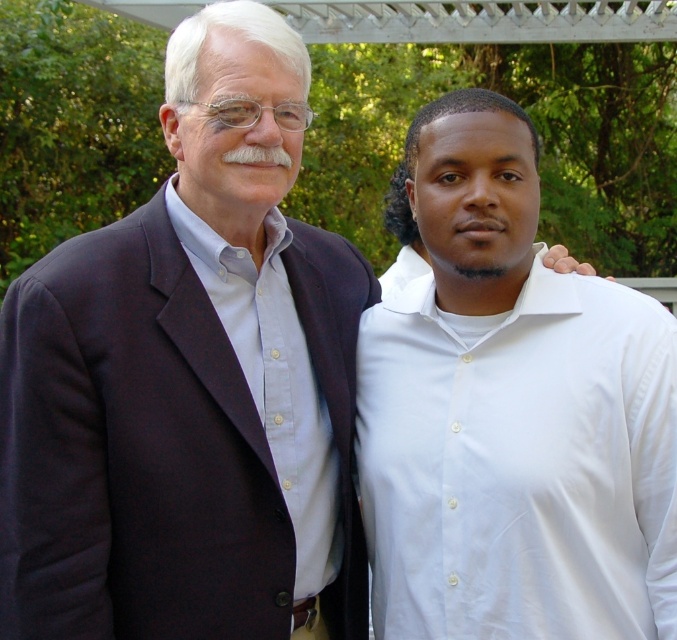
Question: From the image, what is the correct spatial relationship of dark blue fabric business suit at left in relation to light blue cotton shirt at left?

Choices:
 (A) below
 (B) above

Answer: (A)

Question: Does dark blue fabric business suit at left appear over white smooth shirt at right?

Choices:
 (A) yes
 (B) no

Answer: (A)

Question: Can you confirm if white smooth shirt at right is bigger than light blue cotton shirt at left?

Choices:
 (A) no
 (B) yes

Answer: (B)

Question: Estimate the real-world distances between objects in this image. Which object is closer to the dark blue fabric business suit at left?

Choices:
 (A) white smooth shirt at right
 (B) light blue cotton shirt at left

Answer: (B)

Question: Estimate the real-world distances between objects in this image. Which object is farther from the dark blue fabric business suit at left?

Choices:
 (A) light blue cotton shirt at left
 (B) white smooth shirt at right

Answer: (B)

Question: Which point appears farthest from the camera in this image?

Choices:
 (A) (502, 413)
 (B) (332, 417)

Answer: (B)